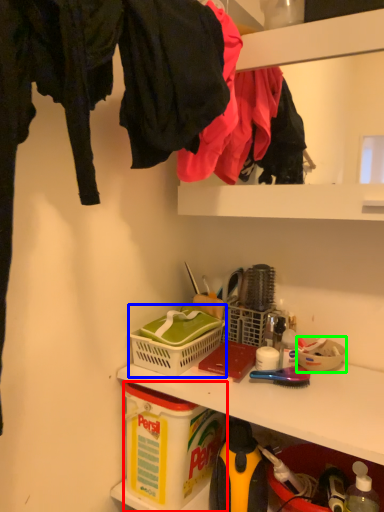
Question: Estimate the real-world distances between objects in this image. Which object is farther from box (highlighted by a red box), picnic basket (highlighted by a blue box) or bowl (highlighted by a green box)?

Choices:
 (A) picnic basket
 (B) bowl

Answer: (B)